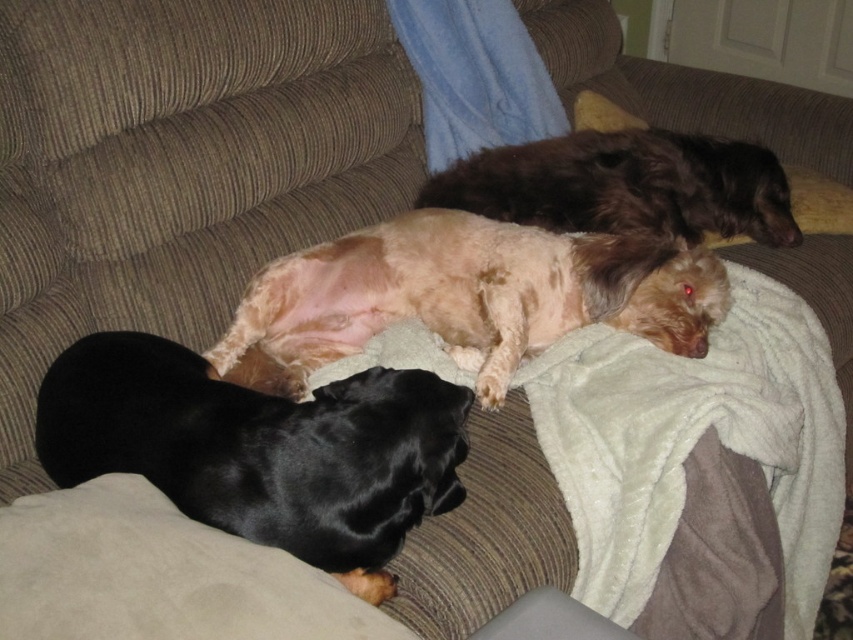
Question: Is suede-like beige pillow at lower left positioned in front of white fabric at lower center?

Choices:
 (A) yes
 (B) no

Answer: (A)

Question: Which object is the farthest from the shiny brown fur at upper right?

Choices:
 (A) shiny black dog at lower left
 (B) suede-like beige pillow at lower left
 (C) white fluffy blanket at center
 (D) fuzzy beige dog at center

Answer: (B)

Question: Which object is positioned farthest from the fuzzy beige dog at center?

Choices:
 (A) shiny black dog at lower left
 (B) white fabric at lower center
 (C) shiny brown fur at upper right

Answer: (B)

Question: Among these points, which one is farthest from the camera?

Choices:
 (A) (570, 608)
 (B) (662, 470)
 (C) (490, 179)
 (D) (488, 388)

Answer: (C)

Question: Is white fluffy blanket at center wider than fuzzy beige dog at center?

Choices:
 (A) no
 (B) yes

Answer: (A)

Question: Is suede-like beige pillow at lower left bigger than shiny brown fur at upper right?

Choices:
 (A) yes
 (B) no

Answer: (B)